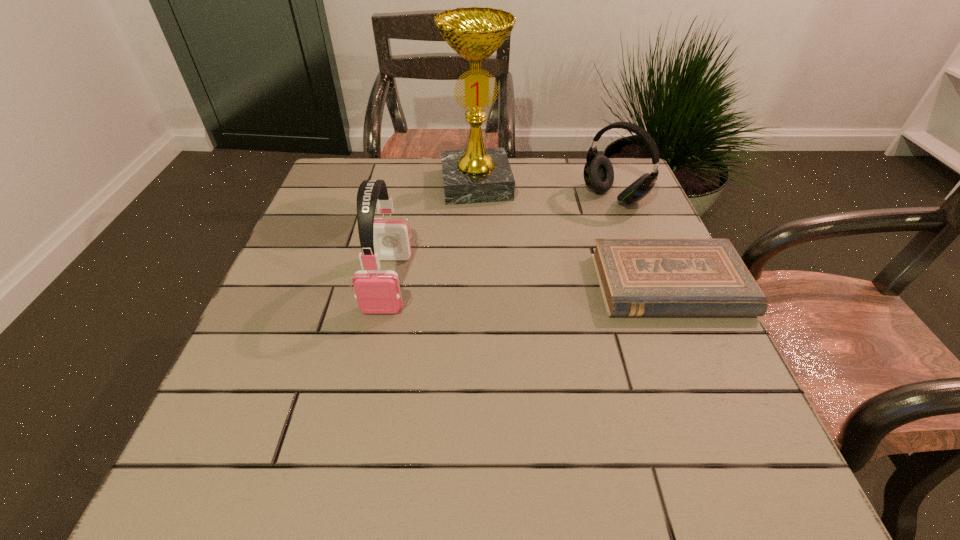
The image size is (960, 540). I want to click on the leftmost object, so click(x=377, y=291).

The height and width of the screenshot is (540, 960). Find the location of `earphone`. earphone is located at coordinates (377, 291).

Locate an element on the screen. The image size is (960, 540). the shortest object is located at coordinates (638, 277).

This screenshot has width=960, height=540. I want to click on award, so click(x=477, y=174).

The height and width of the screenshot is (540, 960). Identify the location of the tallest object. (477, 174).

You are a GUI agent. You are given a task and a screenshot of the screen. Output one action in this format:
    pyautogui.click(x=<x>, y=<y>)
    Task: Click on the second shortest object
    
    Given the screenshot: What is the action you would take?
    pyautogui.click(x=598, y=173)

Locate an element on the screen. This screenshot has width=960, height=540. free region located 0.120m on the outer surface of the earphone is located at coordinates (370, 366).

Find the location of `free location located on the spine side of the shortest object`. free location located on the spine side of the shortest object is located at coordinates (699, 354).

Identify the location of free point located 0.400m on the front-facing side of the second object from left to right. The width and height of the screenshot is (960, 540). (503, 320).

Image resolution: width=960 pixels, height=540 pixels. What are the coordinates of `vacant region located on the front-facing side of the second object from left to right` in the screenshot? It's located at (483, 219).